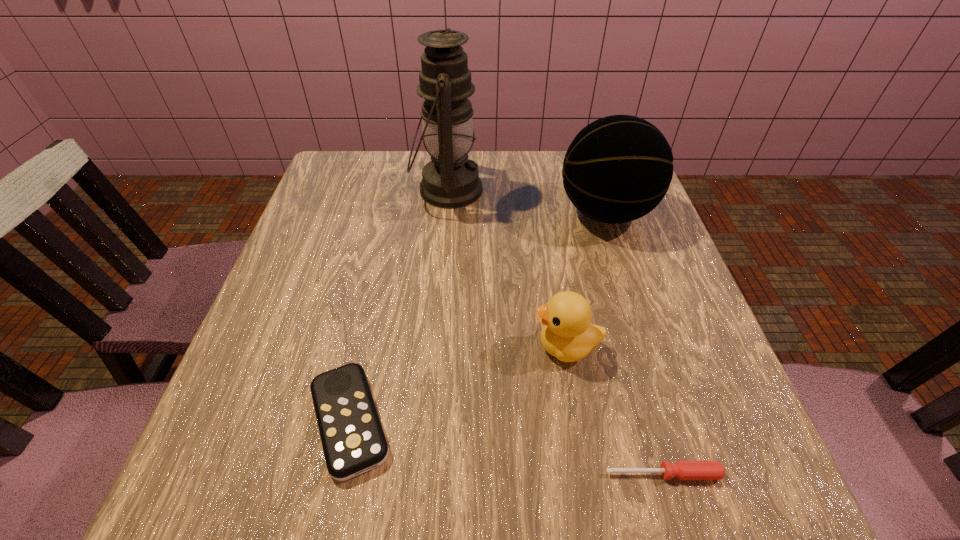
At what (x,y) coordinates should I click in order to perform the action: click on object that is at the near left corner. Please return your answer as a coordinate pair (x, y). The image size is (960, 540). Looking at the image, I should click on (353, 440).

You are a GUI agent. You are given a task and a screenshot of the screen. Output one action in this format:
    pyautogui.click(x=<x>, y=<y>)
    Task: Click on the object located at the far right corner
    This screenshot has width=960, height=540.
    Given the screenshot: What is the action you would take?
    pyautogui.click(x=617, y=169)

I want to click on object that is at the near right corner, so click(684, 470).

Where is `free point at the far edge`? The height and width of the screenshot is (540, 960). free point at the far edge is located at coordinates (382, 187).

Where is `free space at the near edge of the desktop`? free space at the near edge of the desktop is located at coordinates (593, 496).

Identify the location of vacant space at the left edge of the desktop. (318, 289).

Identify the location of free space at the right edge of the desktop. (604, 259).

Identify the location of vacant space at the far left corner of the desktop. This screenshot has height=540, width=960. click(x=352, y=164).

At what (x,y) coordinates should I click in order to perform the action: click on vacant area at the near right corner. Please return your answer as a coordinate pair (x, y). Looking at the image, I should click on (765, 474).

This screenshot has width=960, height=540. Identify the location of free space between the remote control and the second tallest object. (477, 317).